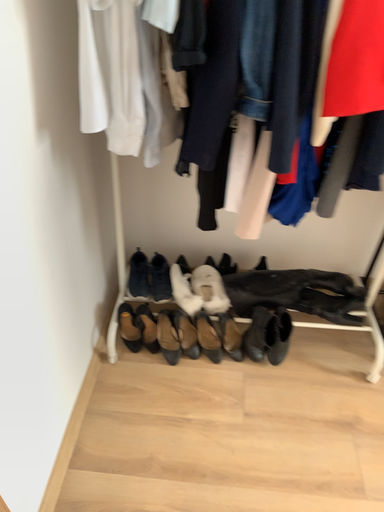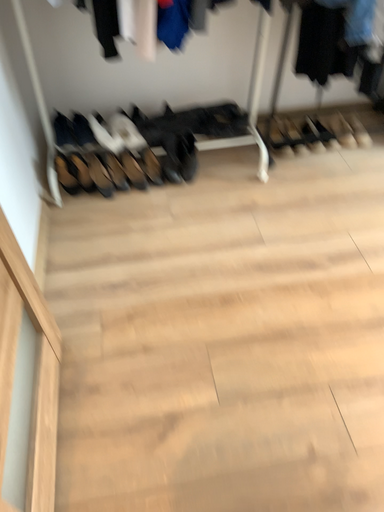
Question: Which way did the camera rotate in the video?

Choices:
 (A) rotated right
 (B) rotated left

Answer: (A)